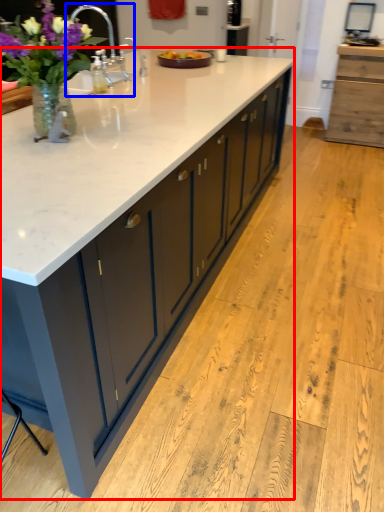
Question: Among these objects, which one is farthest to the camera, countertop (highlighted by a red box) or sink (highlighted by a blue box)?

Choices:
 (A) countertop
 (B) sink

Answer: (B)